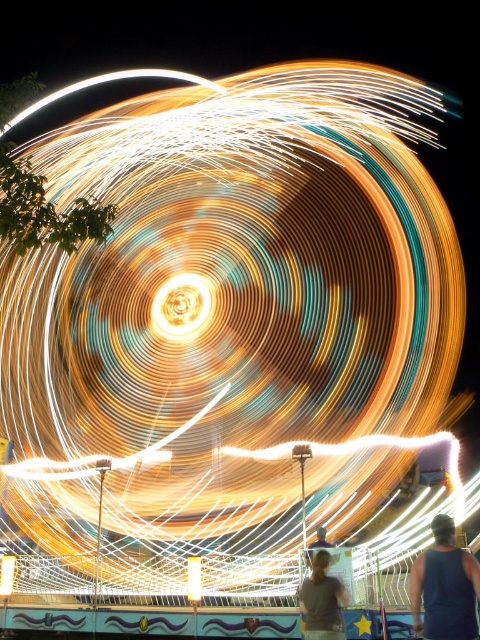
You are a photographer trying to capture the golden spiral at center and the gray matte shirt at lower center in the same frame. Based on their sizes in the image, which object would appear more prominent in your photo?

The golden spiral at center would appear more prominent in the photo because its width is larger than that of the gray matte shirt at lower center.